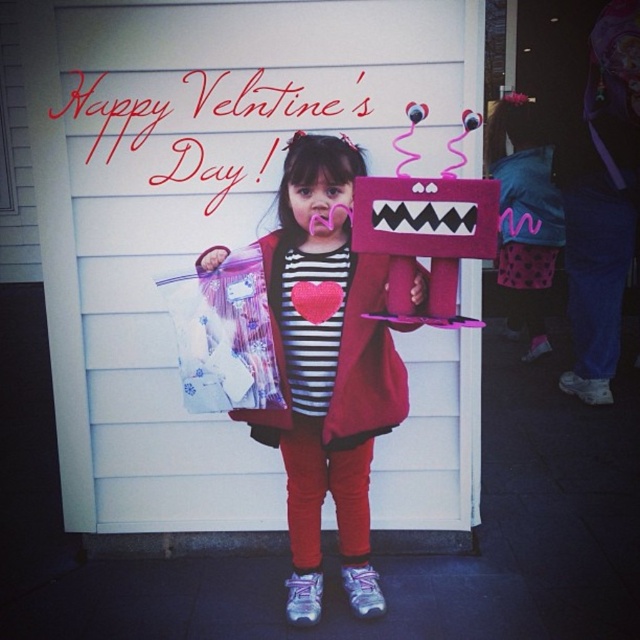
Between white wood garage door at center and felt plush toy at center, which one is positioned lower?

white wood garage door at center is below.

Does white wood garage door at center appear on the right side of felt plush toy at center?

Incorrect, white wood garage door at center is not on the right side of felt plush toy at center.

This screenshot has height=640, width=640. What do you see at coordinates (200, 209) in the screenshot?
I see `white wood garage door at center` at bounding box center [200, 209].

Locate an element on the screen. white wood garage door at center is located at coordinates (200, 209).

Who is taller, matte pink plush toy at center or felt plush toy at center?

matte pink plush toy at center

Is point (284, 381) positioned behind point (396, 196)?

That is True.

I want to click on matte pink plush toy at center, so pos(326,372).

Which is below, white wood garage door at center or matte pink plush toy at center?

Positioned lower is matte pink plush toy at center.

Is white wood garage door at center below matte pink plush toy at center?

Actually, white wood garage door at center is above matte pink plush toy at center.

Who is more forward, (92, 225) or (291, 620)?

Point (291, 620) is more forward.

I want to click on white wood garage door at center, so click(200, 209).